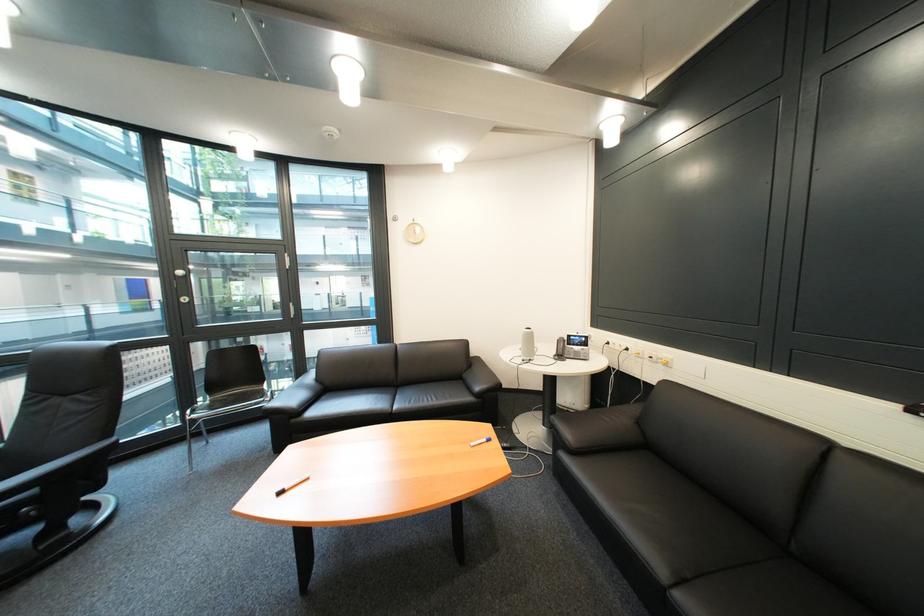
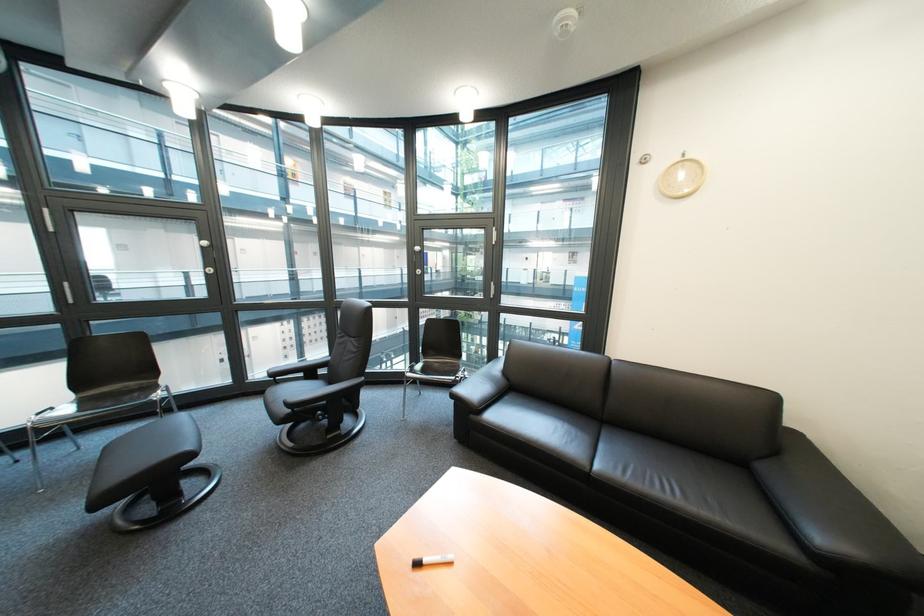
The point at (307,422) is marked in the first image. Where is the corresponding point in the second image?

(485, 418)